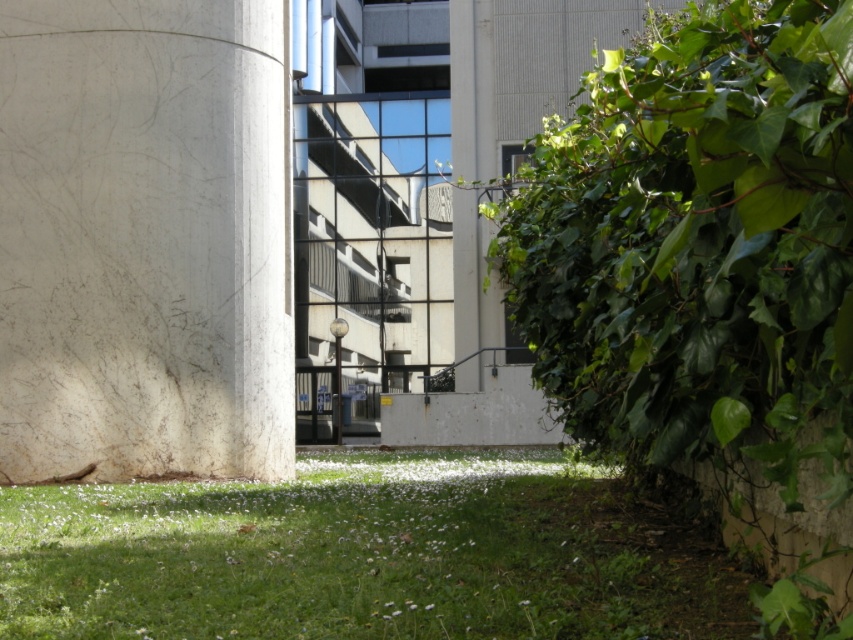
You are a photographer standing in front of the green leafy hedge at right. You want to take a photo of the modern building with glass facade and metal framework in the center. Considering your current position, will you be able to capture the entire building in one shot without moving closer or further away?

The distance between the green leafy hedge at right and the camera is 2.05 meters. Since the modern building with glass facade and metal framework in the center is in the center of the image, it is likely within the camera frame. However, whether the entire building can be captured depends on the camera lens and field of view. Without specific lens information, it is impossible to determine.

You are a landscape architect designing a garden. You have a white marble pillar at left and green grass at lower center in your design. Which object takes up more space in the scene?

The green grass at lower center takes up more space in the scene because the white marble pillar at left is smaller than it.